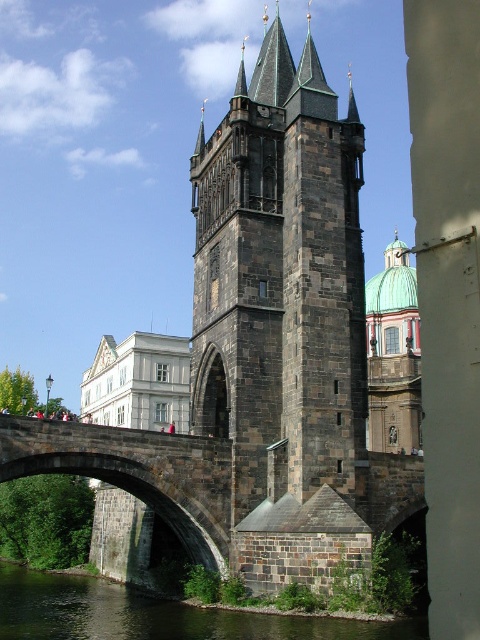
You are a tourist standing on the Charles Bridge and want to take a photo of the dark stone tower at center and the greenish stone water at lower left. Which object should you point your camera upwards to capture?

You should point your camera upwards to capture the dark stone tower at center because it is located above the greenish stone water at lower left.

You are an architect examining the Charles Bridge. You notice the dark stone tower at center and the greenish stone water at lower left. Which object occupies a larger area in the image?

The dark stone tower at center is bigger than greenish stone water at lower left, so the dark stone tower at center occupies a larger area in the image.

You are standing on the historic stone bridge and want to take a photo that includes both the central tower and the white building in the background. You notice two points marked on your camera screen at coordinates point [285,248] and point [11,620]. Which point is closer to you, the photographer?

Point [285,248] is closer to you because it is further to the viewer than point [11,620].